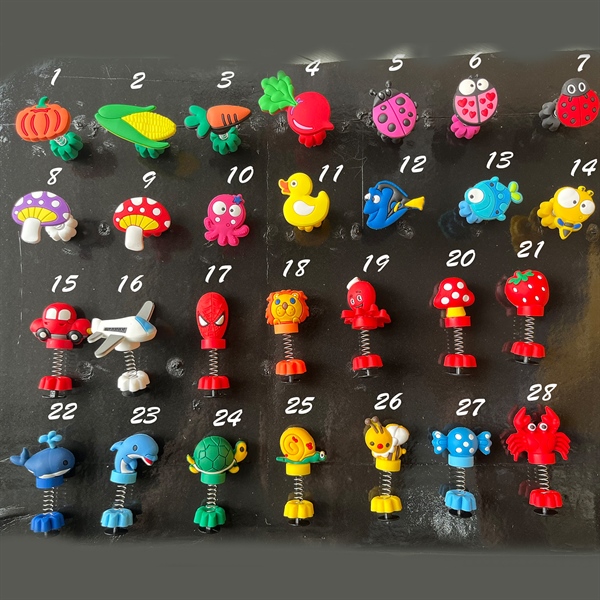
Where is `first row of toys`? The image size is (600, 600). first row of toys is located at coordinates (52, 125), (136, 120), (226, 116), (303, 111), (475, 103), (402, 111), (581, 99).